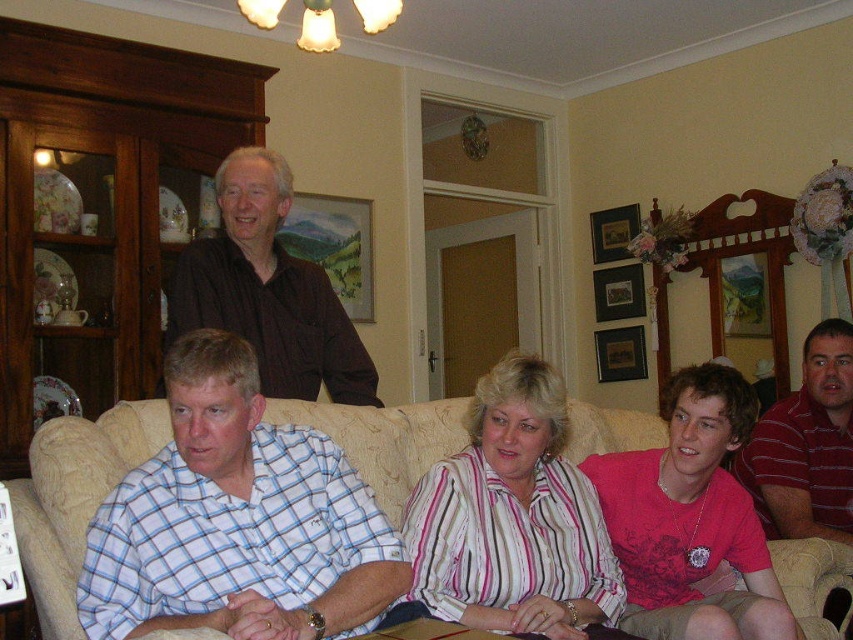
Question: Is pink striped shirt at center positioned behind pink fabric shirt at lower right?

Choices:
 (A) no
 (B) yes

Answer: (A)

Question: Is white checkered shirt at lower left to the left of pink striped shirt at center from the viewer's perspective?

Choices:
 (A) yes
 (B) no

Answer: (A)

Question: Is pink striped shirt at center positioned in front of brown matte shirt at upper left?

Choices:
 (A) no
 (B) yes

Answer: (B)

Question: Which object appears farthest from the camera in this image?

Choices:
 (A) white checkered shirt at lower left
 (B) brown matte shirt at upper left

Answer: (B)

Question: Which point appears farthest from the camera in this image?

Choices:
 (A) (242, 573)
 (B) (811, 412)
 (C) (223, 266)
 (D) (490, 588)

Answer: (B)

Question: Which is nearer to the brown matte shirt at upper left?

Choices:
 (A) beige fabric couch at center
 (B) pink striped shirt at center

Answer: (A)